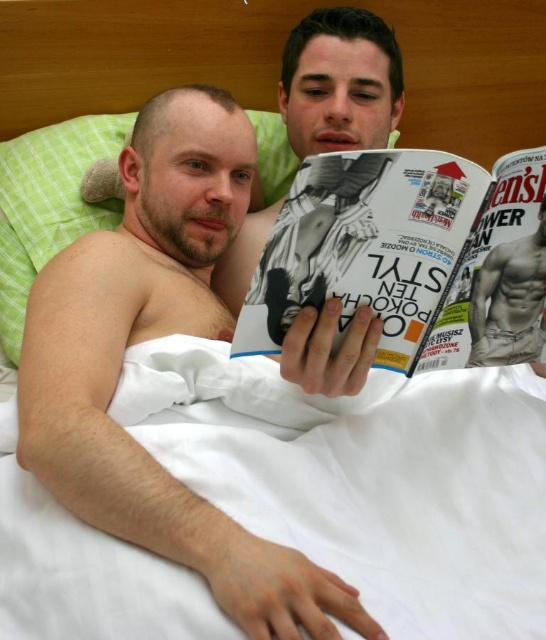
Question: Can you confirm if smooth skin man at left is wider than white glossy magazine at center?

Choices:
 (A) yes
 (B) no

Answer: (A)

Question: Which object is positioned closest to the smooth skin man at left?

Choices:
 (A) green fabric pillow at upper left
 (B) muscular skin torso at center
 (C) white glossy magazine at center

Answer: (C)

Question: Which point is closer to the camera?

Choices:
 (A) (517, 298)
 (B) (287, 141)

Answer: (A)

Question: Can you confirm if smooth skin man at left is thinner than white glossy magazine at center?

Choices:
 (A) yes
 (B) no

Answer: (B)

Question: Does smooth skin man at left lie behind green fabric pillow at upper left?

Choices:
 (A) yes
 (B) no

Answer: (B)

Question: Based on their relative distances, which object is nearer to the green fabric pillow at upper left?

Choices:
 (A) muscular skin torso at center
 (B) smooth skin man at left
 (C) white glossy magazine at center

Answer: (B)